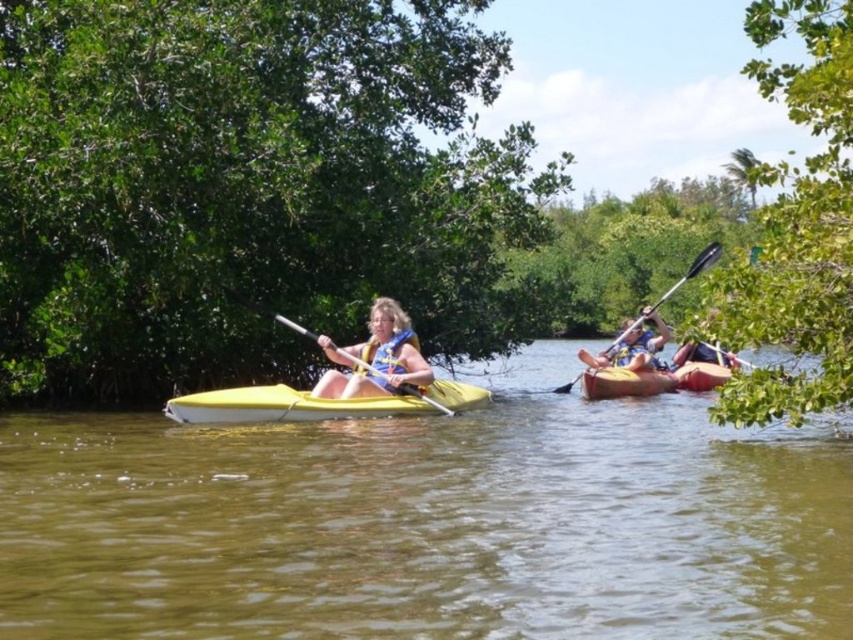
Question: Is yellow plastic kayak at center behind yellow life vest at center?

Choices:
 (A) no
 (B) yes

Answer: (A)

Question: From the image, what is the correct spatial relationship of yellow plastic kayak at center in relation to yellow plastic paddle at center?

Choices:
 (A) right
 (B) left

Answer: (A)

Question: Is matte blue kayak at center smaller than yellow plastic kayak at right?

Choices:
 (A) no
 (B) yes

Answer: (B)

Question: Among these objects, which one is nearest to the camera?

Choices:
 (A) yellow plastic paddle at center
 (B) yellow plastic kayak at right
 (C) yellow life vest at center

Answer: (B)

Question: Considering the real-world distances, which object is closest to the wooden paddle at right?

Choices:
 (A) matte blue kayak at center
 (B) yellow matte kayak at center
 (C) yellow plastic kayak at right

Answer: (A)

Question: Among these objects, which one is farthest from the camera?

Choices:
 (A) yellow matte kayak at center
 (B) yellow plastic kayak at right
 (C) wooden paddle at right

Answer: (C)